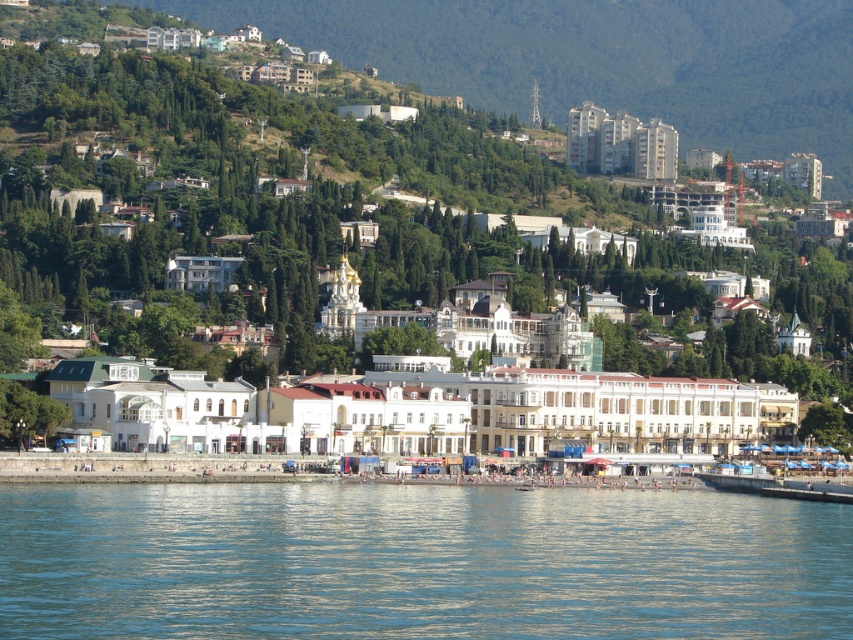
Question: Is white glossy building at center to the left of clear blue water at lower center from the viewer's perspective?

Choices:
 (A) no
 (B) yes

Answer: (B)

Question: Which point is farther from the camera taking this photo?

Choices:
 (A) (776, 602)
 (B) (724, 278)

Answer: (B)

Question: Can you confirm if white glossy building at center is positioned above clear blue water at lower center?

Choices:
 (A) yes
 (B) no

Answer: (A)

Question: Does white glossy building at center come in front of clear blue water at lower center?

Choices:
 (A) no
 (B) yes

Answer: (A)